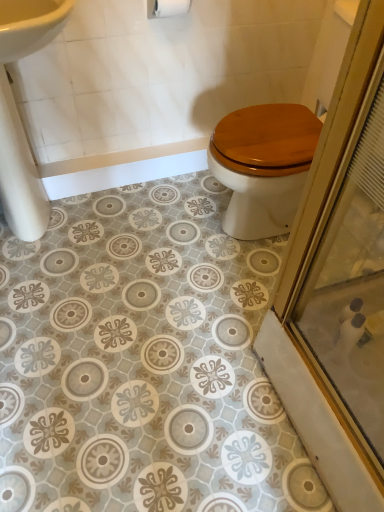
Question: From a real-world perspective, is white matte toilet paper at upper center beneath white glossy sink at upper left?

Choices:
 (A) no
 (B) yes

Answer: (A)

Question: Is white matte toilet paper at upper center positioned in front of white glossy sink at upper left?

Choices:
 (A) no
 (B) yes

Answer: (A)

Question: Considering the relative positions of white matte toilet paper at upper center and white glossy sink at upper left in the image provided, is white matte toilet paper at upper center to the left of white glossy sink at upper left from the viewer's perspective?

Choices:
 (A) yes
 (B) no

Answer: (B)

Question: Does white matte toilet paper at upper center have a lesser width compared to white glossy sink at upper left?

Choices:
 (A) no
 (B) yes

Answer: (B)

Question: Is white matte toilet paper at upper center facing away from white glossy sink at upper left?

Choices:
 (A) no
 (B) yes

Answer: (A)

Question: Are white matte toilet paper at upper center and white glossy sink at upper left beside each other?

Choices:
 (A) no
 (B) yes

Answer: (A)

Question: Would you consider white glossy sink at upper left to be distant from white matte toilet paper at upper center?

Choices:
 (A) no
 (B) yes

Answer: (A)

Question: Is white glossy sink at upper left next to white matte toilet paper at upper center and touching it?

Choices:
 (A) yes
 (B) no

Answer: (B)

Question: Is the position of white glossy sink at upper left more distant than that of white matte toilet paper at upper center?

Choices:
 (A) no
 (B) yes

Answer: (A)

Question: Considering the relative positions of white glossy sink at upper left and white matte toilet paper at upper center in the image provided, is white glossy sink at upper left to the right of white matte toilet paper at upper center from the viewer's perspective?

Choices:
 (A) no
 (B) yes

Answer: (A)

Question: From a real-world perspective, is white glossy sink at upper left located beneath white matte toilet paper at upper center?

Choices:
 (A) yes
 (B) no

Answer: (A)

Question: Could white matte toilet paper at upper center be considered to be inside white glossy sink at upper left?

Choices:
 (A) yes
 (B) no

Answer: (B)

Question: In terms of height, does white matte toilet paper at upper center look taller or shorter compared to white glossy sink at upper left?

Choices:
 (A) short
 (B) tall

Answer: (A)